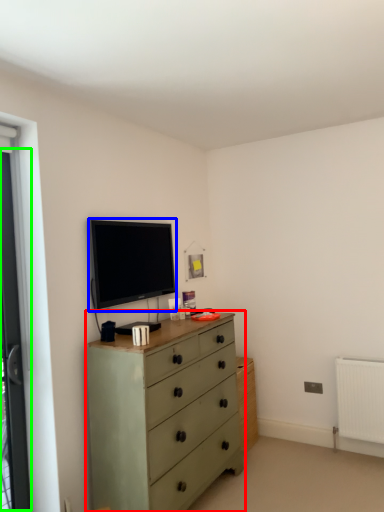
Question: Which object is the closest to the chest of drawers (highlighted by a red box)? Choose among these: television (highlighted by a blue box) or screen door (highlighted by a green box).

Choices:
 (A) television
 (B) screen door

Answer: (A)